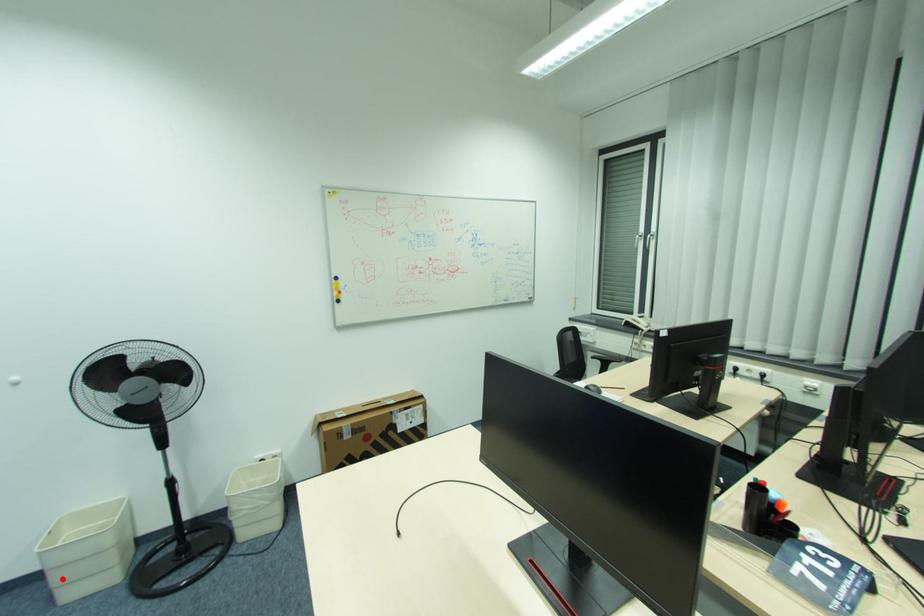
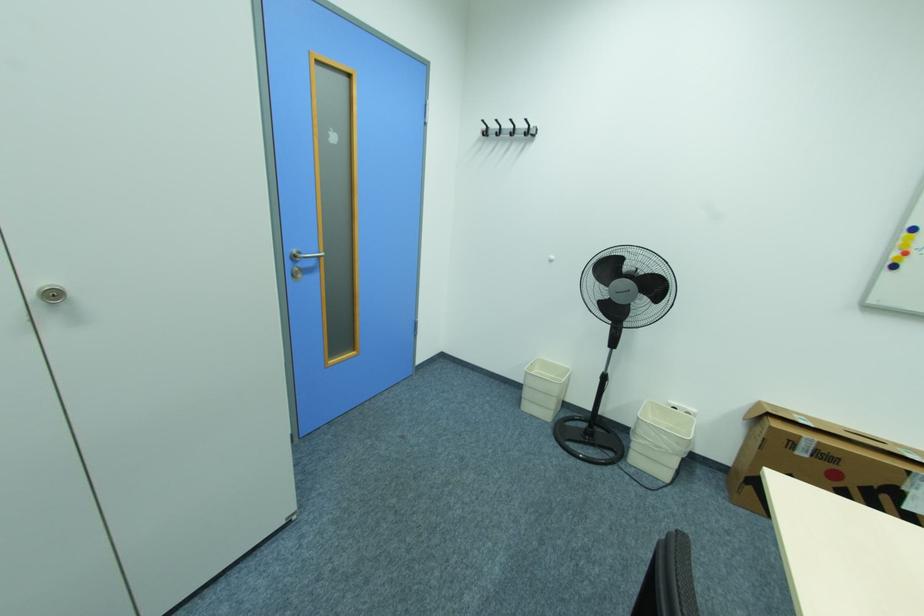
Locate, in the second image, the point that corresponds to the highlighted location in the first image.

(531, 394)